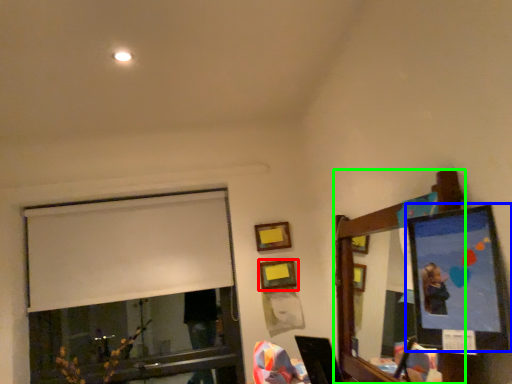
Question: Which object is positioned farthest from picture frame (highlighted by a red box)? Select from picture frame (highlighted by a blue box) and mirror (highlighted by a green box).

Choices:
 (A) picture frame
 (B) mirror

Answer: (A)